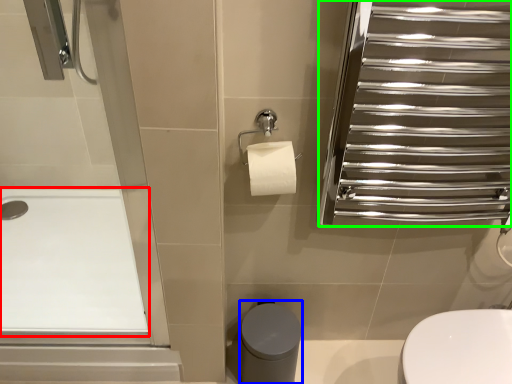
Question: Based on their relative distances, which object is nearer to bath (highlighted by a red box)? Choose from bidet (highlighted by a blue box) and screen door (highlighted by a green box).

Choices:
 (A) bidet
 (B) screen door

Answer: (A)